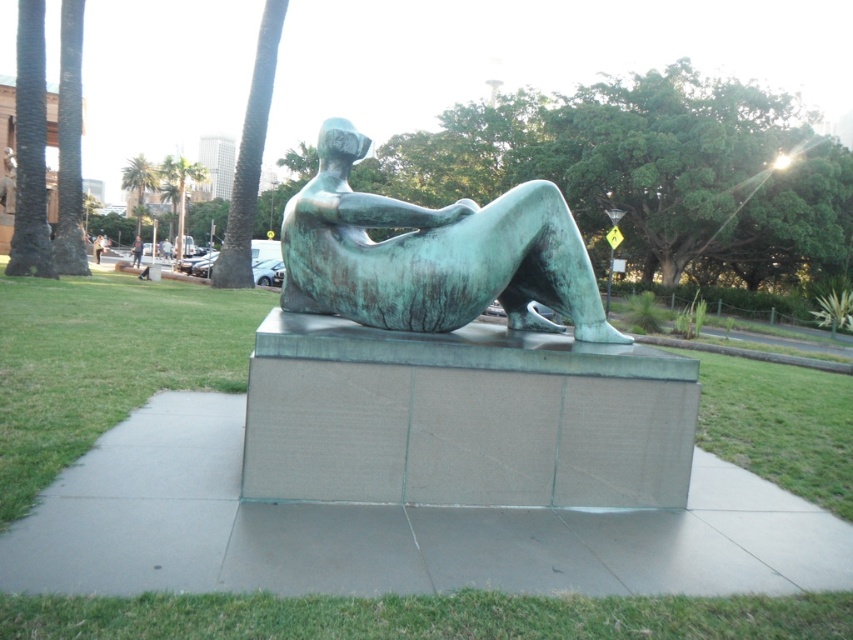
Question: Among these objects, which one is nearest to the camera?

Choices:
 (A) green patina statue at center
 (B) blue-green bronze statue at center

Answer: (A)

Question: Which object is closer to the camera taking this photo?

Choices:
 (A) green patina statue at center
 (B) blue-green bronze statue at center
 (C) green leafy palm tree at upper center

Answer: (A)

Question: Is green patina statue at center smaller than green textured palm tree at upper left?

Choices:
 (A) yes
 (B) no

Answer: (A)

Question: Which point appears closest to the camera in this image?

Choices:
 (A) (181, 204)
 (B) (424, 240)
 (C) (135, 248)

Answer: (B)

Question: Can you confirm if green textured palm tree at upper left is positioned below blue-green bronze statue at center?

Choices:
 (A) no
 (B) yes

Answer: (A)

Question: Is green leafy palm tree at upper center to the left of blue-green bronze statue at center from the viewer's perspective?

Choices:
 (A) no
 (B) yes

Answer: (B)